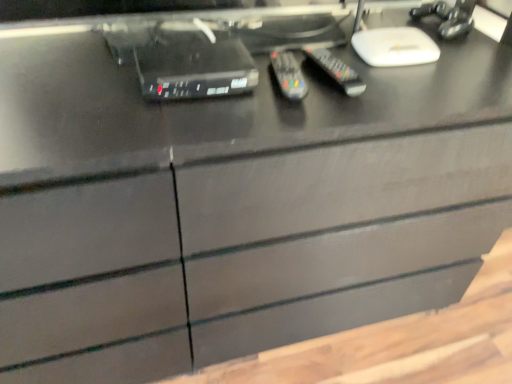
Locate an element on the screen. Image resolution: width=512 pixels, height=384 pixels. vacant area to the right of black plastic remote at center, placed as the 1th control when sorted from left to right is located at coordinates (379, 91).